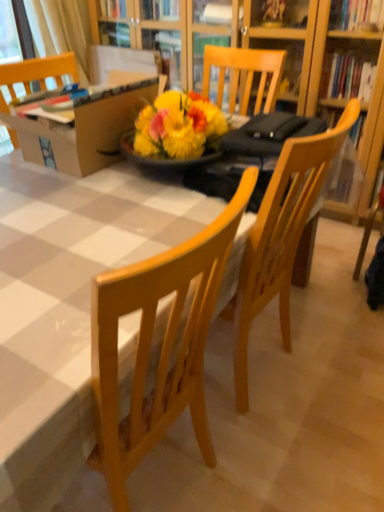
Question: Is wooden table at center closer to camera compared to cardboard box at upper left?

Choices:
 (A) no
 (B) yes

Answer: (B)

Question: Is wooden table at center directly adjacent to cardboard box at upper left?

Choices:
 (A) no
 (B) yes

Answer: (A)

Question: Does wooden table at center have a greater width compared to cardboard box at upper left?

Choices:
 (A) yes
 (B) no

Answer: (A)

Question: Can you confirm if wooden table at center is smaller than cardboard box at upper left?

Choices:
 (A) no
 (B) yes

Answer: (A)

Question: Is wooden table at center turned away from cardboard box at upper left?

Choices:
 (A) no
 (B) yes

Answer: (A)

Question: From the image's perspective, does wooden table at center appear lower than cardboard box at upper left?

Choices:
 (A) yes
 (B) no

Answer: (A)

Question: Does white fabric curtain at upper left have a lesser height compared to cardboard box at upper left?

Choices:
 (A) no
 (B) yes

Answer: (A)

Question: Is white fabric curtain at upper left positioned before cardboard box at upper left?

Choices:
 (A) yes
 (B) no

Answer: (B)

Question: Considering the relative sizes of white fabric curtain at upper left and cardboard box at upper left in the image provided, is white fabric curtain at upper left wider than cardboard box at upper left?

Choices:
 (A) no
 (B) yes

Answer: (A)

Question: Is white fabric curtain at upper left far from cardboard box at upper left?

Choices:
 (A) no
 (B) yes

Answer: (B)

Question: Is white fabric curtain at upper left oriented away from cardboard box at upper left?

Choices:
 (A) no
 (B) yes

Answer: (A)

Question: From a real-world perspective, is white fabric curtain at upper left beneath cardboard box at upper left?

Choices:
 (A) no
 (B) yes

Answer: (B)

Question: Would you say white fabric curtain at upper left is part of cardboard box at upper left's contents?

Choices:
 (A) yes
 (B) no

Answer: (B)